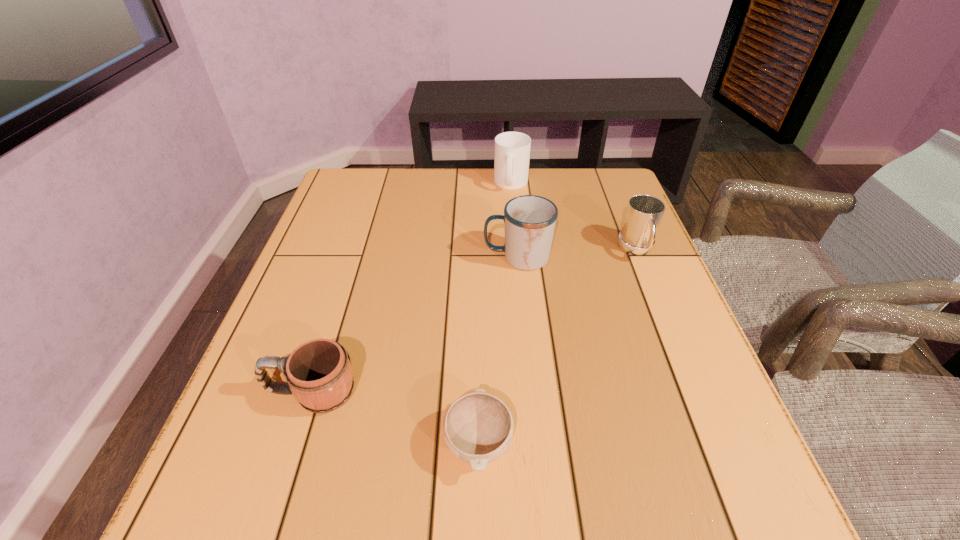
At what (x,y) coordinates should I click in order to perform the action: click on vacant space that satisfies the following two spatial constraints: 1. on the side of the rightmost object with the handle; 2. on the side of the second shortest object with the handle. Please return your answer as a coordinate pair (x, y). The height and width of the screenshot is (540, 960). Looking at the image, I should click on (695, 393).